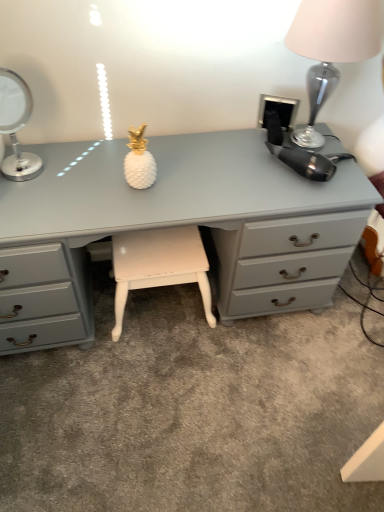
Question: Does matte gray desk at center appear on the right side of metallic silver table lamp at upper right, the 2th table lamp from the left?

Choices:
 (A) no
 (B) yes

Answer: (A)

Question: Is matte gray desk at center thinner than metallic silver table lamp at upper right, the 2th table lamp from the left?

Choices:
 (A) yes
 (B) no

Answer: (B)

Question: Does matte gray desk at center lie in front of metallic silver table lamp at upper right, the 2th table lamp from the left?

Choices:
 (A) no
 (B) yes

Answer: (A)

Question: Is matte gray desk at center wider than metallic silver table lamp at upper right, the 2th table lamp from the left?

Choices:
 (A) yes
 (B) no

Answer: (A)

Question: Does matte gray desk at center have a greater height compared to metallic silver table lamp at upper right, the 2th table lamp from the left?

Choices:
 (A) yes
 (B) no

Answer: (A)

Question: Is silver metallic table lamp at left, marked as the second table lamp in a right-to-left arrangement, situated inside matte gray desk at center or outside?

Choices:
 (A) outside
 (B) inside

Answer: (A)

Question: Considering the positions of silver metallic table lamp at left, which appears as the 1th table lamp when viewed from the left, and matte gray desk at center in the image, is silver metallic table lamp at left, which appears as the 1th table lamp when viewed from the left, bigger or smaller than matte gray desk at center?

Choices:
 (A) big
 (B) small

Answer: (B)

Question: In the image, is silver metallic table lamp at left, which appears as the 1th table lamp when viewed from the left, positioned in front of or behind matte gray desk at center?

Choices:
 (A) behind
 (B) front

Answer: (B)

Question: Visually, is silver metallic table lamp at left, marked as the second table lamp in a right-to-left arrangement, positioned to the left or to the right of matte gray desk at center?

Choices:
 (A) left
 (B) right

Answer: (A)

Question: From a real-world perspective, is silver metallic table lamp at left, marked as the second table lamp in a right-to-left arrangement, positioned above or below metallic silver table lamp at upper right, which appears as the first table lamp when viewed from the right?

Choices:
 (A) below
 (B) above

Answer: (A)

Question: Based on their sizes in the image, would you say silver metallic table lamp at left, marked as the second table lamp in a right-to-left arrangement, is bigger or smaller than metallic silver table lamp at upper right, the 2th table lamp from the left?

Choices:
 (A) small
 (B) big

Answer: (A)

Question: Choose the correct answer: Is silver metallic table lamp at left, marked as the second table lamp in a right-to-left arrangement, inside metallic silver table lamp at upper right, the 2th table lamp from the left, or outside it?

Choices:
 (A) outside
 (B) inside

Answer: (A)

Question: Is silver metallic table lamp at left, which appears as the 1th table lamp when viewed from the left, in front of or behind metallic silver table lamp at upper right, which appears as the first table lamp when viewed from the right, in the image?

Choices:
 (A) front
 (B) behind

Answer: (B)

Question: From the image's perspective, is matte gray desk at center located above or below silver metallic table lamp at left, marked as the second table lamp in a right-to-left arrangement?

Choices:
 (A) below
 (B) above

Answer: (A)

Question: In the image, is matte gray desk at center on the left side or the right side of silver metallic table lamp at left, marked as the second table lamp in a right-to-left arrangement?

Choices:
 (A) right
 (B) left

Answer: (A)